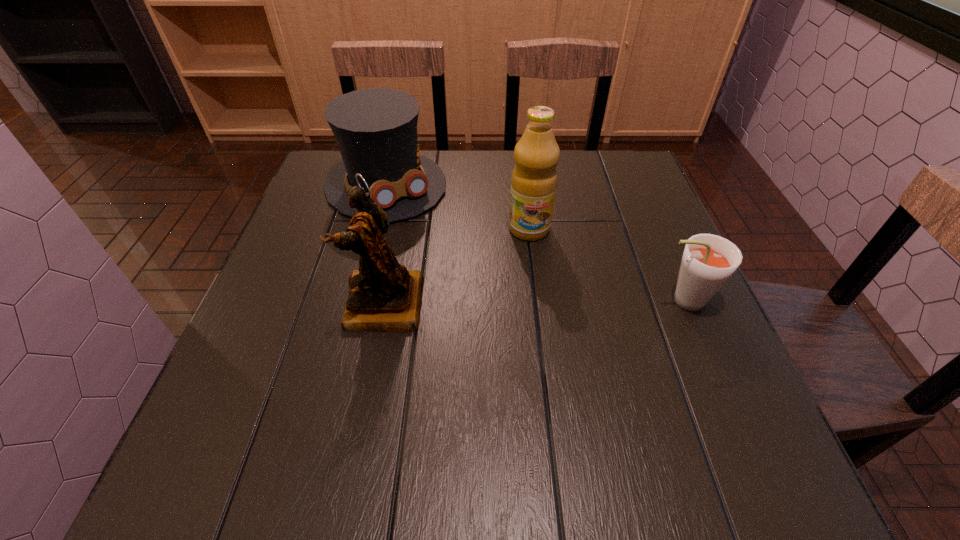
Find the location of `unoccupied position between the rightmost object and the third tallest object`. unoccupied position between the rightmost object and the third tallest object is located at coordinates (534, 242).

This screenshot has width=960, height=540. Identify the location of vacant space that is in between the olive oil and the dress hat. (458, 207).

Where is `vacant space that's between the olive oil and the dress hat`? The height and width of the screenshot is (540, 960). vacant space that's between the olive oil and the dress hat is located at coordinates (458, 207).

Locate which object ranks third in proximity to the second object from right to left. Please provide its 2D coordinates. Your answer should be formatted as a tuple, i.e. [(x, y)], where the tuple contains the x and y coordinates of a point satisfying the conditions above.

[(708, 261)]

The height and width of the screenshot is (540, 960). What are the coordinates of `object that is the third closest one to the figurine` in the screenshot? It's located at (708, 261).

The height and width of the screenshot is (540, 960). Find the location of `free space that satisfies the following two spatial constraints: 1. on the front side of the figurine; 2. on the front-facing side of the third tallest object`. free space that satisfies the following two spatial constraints: 1. on the front side of the figurine; 2. on the front-facing side of the third tallest object is located at coordinates (354, 305).

Where is `vacant space that satisfies the following two spatial constraints: 1. on the front side of the rightmost object; 2. on the drink side of the olive oil`? vacant space that satisfies the following two spatial constraints: 1. on the front side of the rightmost object; 2. on the drink side of the olive oil is located at coordinates (538, 300).